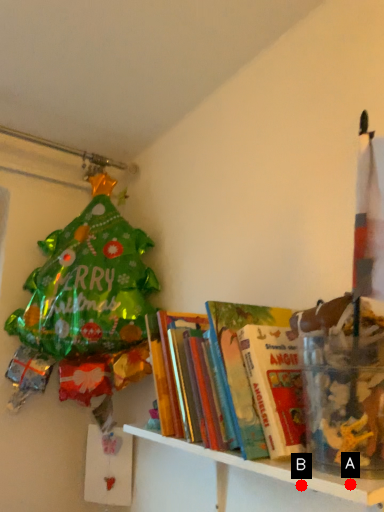
Question: Two points are circled on the image, labeled by A and B beside each circle. Which point is closer to the camera?

Choices:
 (A) A is closer
 (B) B is closer

Answer: (A)